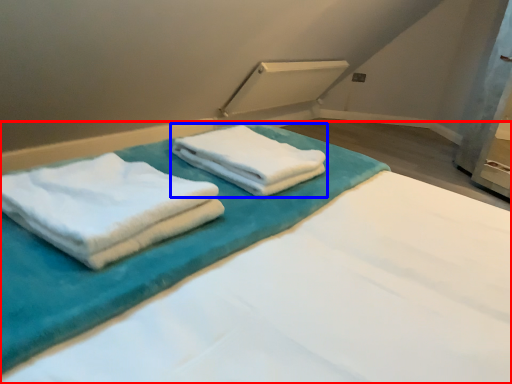
Question: Which of the following is the farthest to the observer, bed (highlighted by a red box) or towel (highlighted by a blue box)?

Choices:
 (A) bed
 (B) towel

Answer: (B)